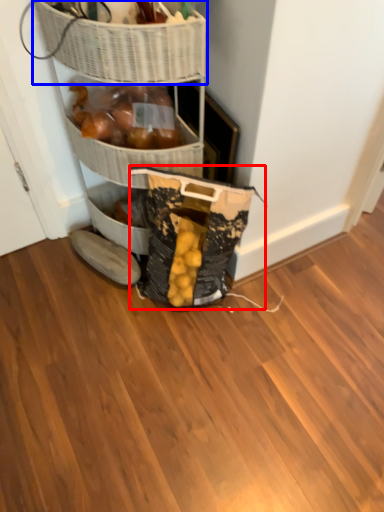
Question: Which object appears farthest to the camera in this image, material (highlighted by a red box) or basket (highlighted by a blue box)?

Choices:
 (A) material
 (B) basket

Answer: (A)